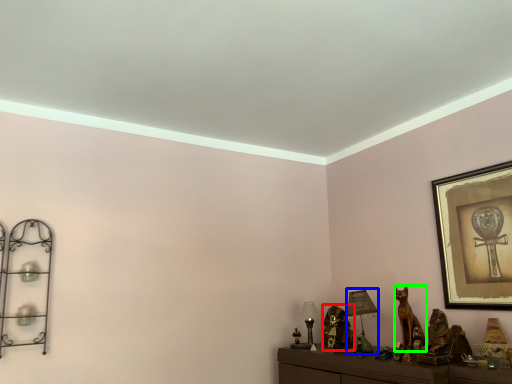
Question: Which is farther away from animal (highlighted by a red box)? table lamp (highlighted by a blue box) or animal (highlighted by a green box)?

Choices:
 (A) table lamp
 (B) animal

Answer: (B)